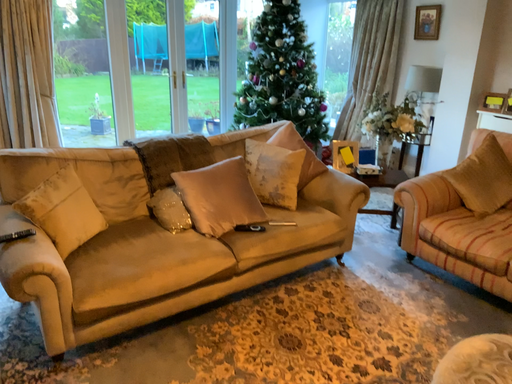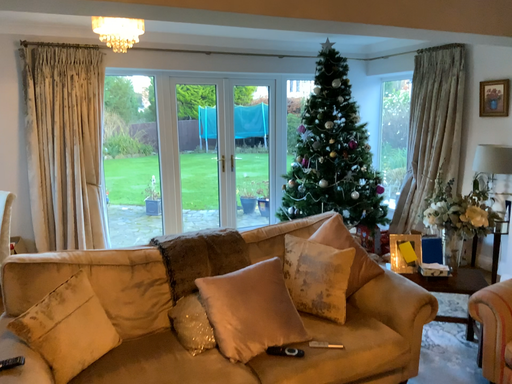
Question: How did the camera likely rotate when shooting the video?

Choices:
 (A) rotated upward
 (B) rotated downward

Answer: (A)